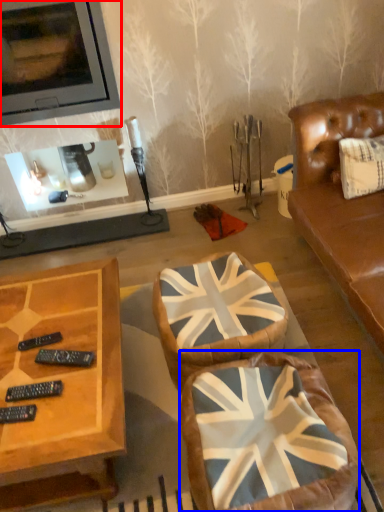
Question: Which point is closer to the camera, picture frame (highlighted by a red box) or swivel chair (highlighted by a blue box)?

Choices:
 (A) picture frame
 (B) swivel chair

Answer: (B)